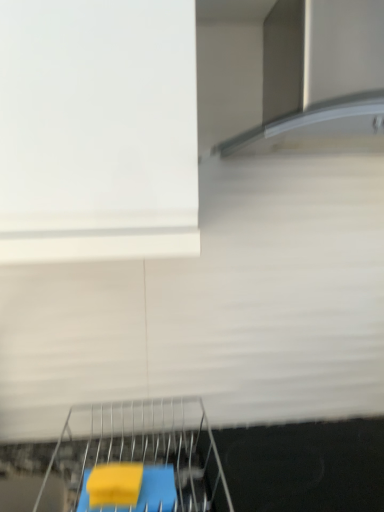
What do you see at coordinates (319, 77) in the screenshot? I see `satin silver exhaust hood at upper center` at bounding box center [319, 77].

Identify the location of satin silver exhaust hood at upper center. (319, 77).

Identify the location of metal wire rack at lower center. This screenshot has width=384, height=512. (135, 459).

Describe the element at coordinates (135, 459) in the screenshot. I see `metal wire rack at lower center` at that location.

Identify the location of satin silver exhaust hood at upper center. (319, 77).

Which is more to the right, satin silver exhaust hood at upper center or metal wire rack at lower center?

From the viewer's perspective, satin silver exhaust hood at upper center appears more on the right side.

Considering the positions of objects satin silver exhaust hood at upper center and metal wire rack at lower center in the image provided, who is behind, satin silver exhaust hood at upper center or metal wire rack at lower center?

metal wire rack at lower center is further away from the camera.

Does point (280, 87) appear closer or farther from the camera than point (146, 426)?

Point (280, 87) appears to be closer to the viewer than point (146, 426).

From the image's perspective, which one is positioned lower, satin silver exhaust hood at upper center or metal wire rack at lower center?

metal wire rack at lower center appears lower in the image.

From a real-world perspective, relative to metal wire rack at lower center, is satin silver exhaust hood at upper center vertically above or below?

satin silver exhaust hood at upper center is above metal wire rack at lower center.

Which object is thinner, satin silver exhaust hood at upper center or metal wire rack at lower center?

With smaller width is satin silver exhaust hood at upper center.

In terms of height, does satin silver exhaust hood at upper center look taller or shorter compared to metal wire rack at lower center?

Considering their sizes, satin silver exhaust hood at upper center has more height than metal wire rack at lower center.

Is satin silver exhaust hood at upper center bigger or smaller than metal wire rack at lower center?

In the image, satin silver exhaust hood at upper center appears to be larger than metal wire rack at lower center.

Would you say satin silver exhaust hood at upper center contains metal wire rack at lower center?

No, metal wire rack at lower center is not inside satin silver exhaust hood at upper center.

Can you see satin silver exhaust hood at upper center touching metal wire rack at lower center?

satin silver exhaust hood at upper center and metal wire rack at lower center are clearly separated.

Is satin silver exhaust hood at upper center turned away from metal wire rack at lower center?

satin silver exhaust hood at upper center does not have its back to metal wire rack at lower center.

The image size is (384, 512). What are the coordinates of `exhaust hood that is in front of the metal wire rack at lower center` in the screenshot? It's located at (319, 77).

Is metal wire rack at lower center at the right side of satin silver exhaust hood at upper center?

No.

Which object is further away from the camera, metal wire rack at lower center or satin silver exhaust hood at upper center?

Positioned behind is metal wire rack at lower center.

Which is closer to the camera, (x=189, y=420) or (x=372, y=3)?

Clearly, point (x=189, y=420) is more distant from the camera than point (x=372, y=3).

From the image's perspective, which one is positioned higher, metal wire rack at lower center or satin silver exhaust hood at upper center?

satin silver exhaust hood at upper center.

From a real-world perspective, between metal wire rack at lower center and satin silver exhaust hood at upper center, who is vertically lower?

metal wire rack at lower center is physically lower.

Which object is thinner, metal wire rack at lower center or satin silver exhaust hood at upper center?

satin silver exhaust hood at upper center is thinner.

Is metal wire rack at lower center taller or shorter than satin silver exhaust hood at upper center?

Considering their sizes, metal wire rack at lower center has less height than satin silver exhaust hood at upper center.

Considering the sizes of metal wire rack at lower center and satin silver exhaust hood at upper center in the image, is metal wire rack at lower center bigger or smaller than satin silver exhaust hood at upper center?

Considering their sizes, metal wire rack at lower center takes up less space than satin silver exhaust hood at upper center.

Is metal wire rack at lower center positioned beyond the bounds of satin silver exhaust hood at upper center?

That's correct, metal wire rack at lower center is outside of satin silver exhaust hood at upper center.

Based on the photo, is metal wire rack at lower center not close to satin silver exhaust hood at upper center?

No, there isn't a large distance between metal wire rack at lower center and satin silver exhaust hood at upper center.

Is satin silver exhaust hood at upper center at the back of metal wire rack at lower center?

No.

How many degrees apart are the facing directions of metal wire rack at lower center and satin silver exhaust hood at upper center?

The angle between the facing direction of metal wire rack at lower center and the facing direction of satin silver exhaust hood at upper center is 0.15 degrees.

How distant is metal wire rack at lower center from satin silver exhaust hood at upper center?

They are 28.88 inches apart.

In order to click on furniture below the satin silver exhaust hood at upper center (from the image's perspective) in this screenshot , I will do `click(135, 459)`.

This screenshot has height=512, width=384. Identify the location of exhaust hood on the right side of metal wire rack at lower center. (319, 77).

Locate an element on the screen. This screenshot has width=384, height=512. furniture behind the satin silver exhaust hood at upper center is located at coordinates (135, 459).